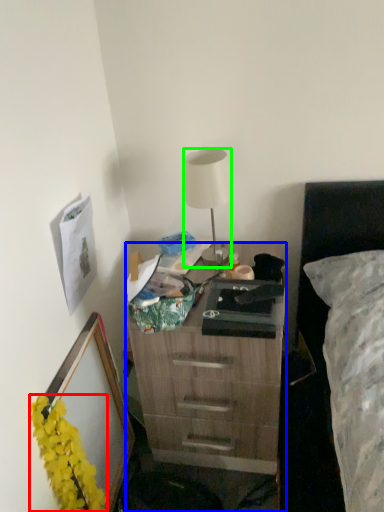
Question: Which object is positioned farthest from flower (highlighted by a red box)? Select from desk (highlighted by a blue box) and lamp (highlighted by a green box).

Choices:
 (A) desk
 (B) lamp

Answer: (B)